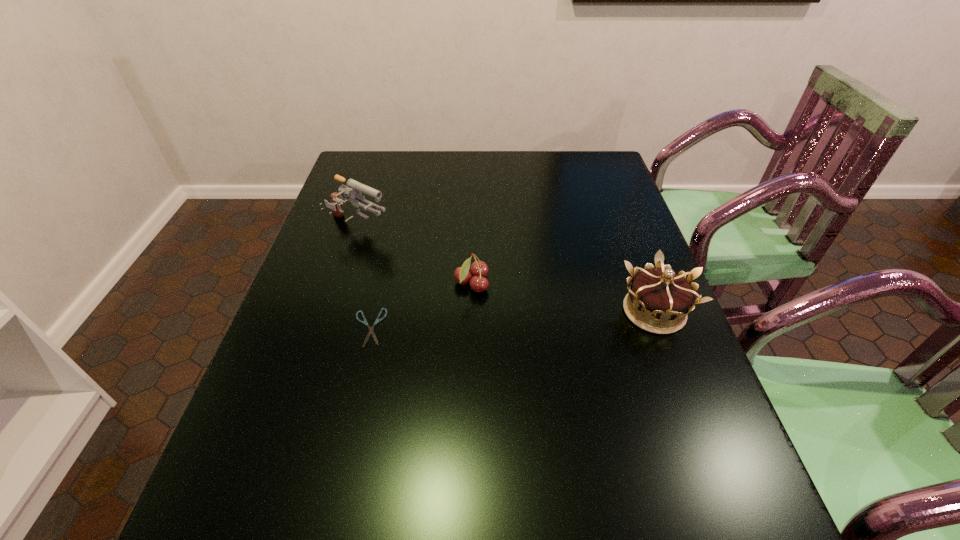
Locate an element on the screen. The width and height of the screenshot is (960, 540). object that stands as the closest to the gun is located at coordinates (479, 269).

The image size is (960, 540). I want to click on free space that satisfies the following two spatial constraints: 1. on the back side of the shears; 2. on the right side of the second object from right to left, so click(379, 284).

The image size is (960, 540). I want to click on vacant space that satisfies the following two spatial constraints: 1. on the front side of the gun; 2. on the right side of the shortest object, so click(327, 327).

Find the location of `vacant space that satisfies the following two spatial constraints: 1. on the back side of the second object from right to left; 2. on the left side of the shears`. vacant space that satisfies the following two spatial constraints: 1. on the back side of the second object from right to left; 2. on the left side of the shears is located at coordinates (379, 284).